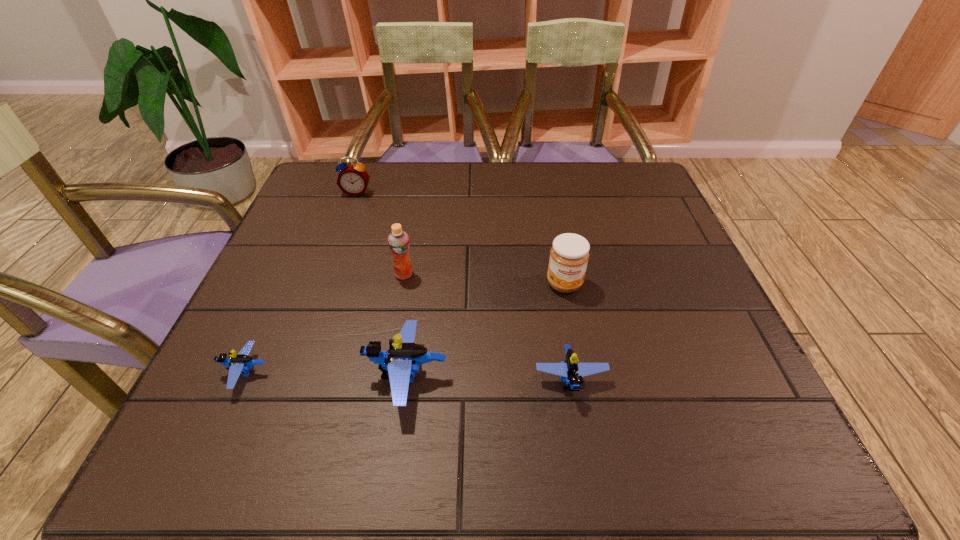
Image resolution: width=960 pixels, height=540 pixels. Find the location of `the leftmost object`. the leftmost object is located at coordinates (239, 364).

Identify the location of the shortest Lego. (239, 364).

In order to click on the second Lego from right to left in this screenshot , I will do `click(402, 360)`.

The image size is (960, 540). What are the coordinates of `the rightmost Lego` in the screenshot? It's located at (570, 371).

What are the coordinates of `the fifth tallest object` in the screenshot? It's located at (570, 371).

Where is `alarm clock`? The image size is (960, 540). alarm clock is located at coordinates (353, 179).

I want to click on the farthest object, so click(353, 179).

Where is `jam`? The height and width of the screenshot is (540, 960). jam is located at coordinates (569, 255).

Image resolution: width=960 pixels, height=540 pixels. I want to click on orange juice, so 398,241.

Image resolution: width=960 pixels, height=540 pixels. In order to click on free region located on the front-facing side of the tallest Lego in this screenshot , I will do `click(333, 376)`.